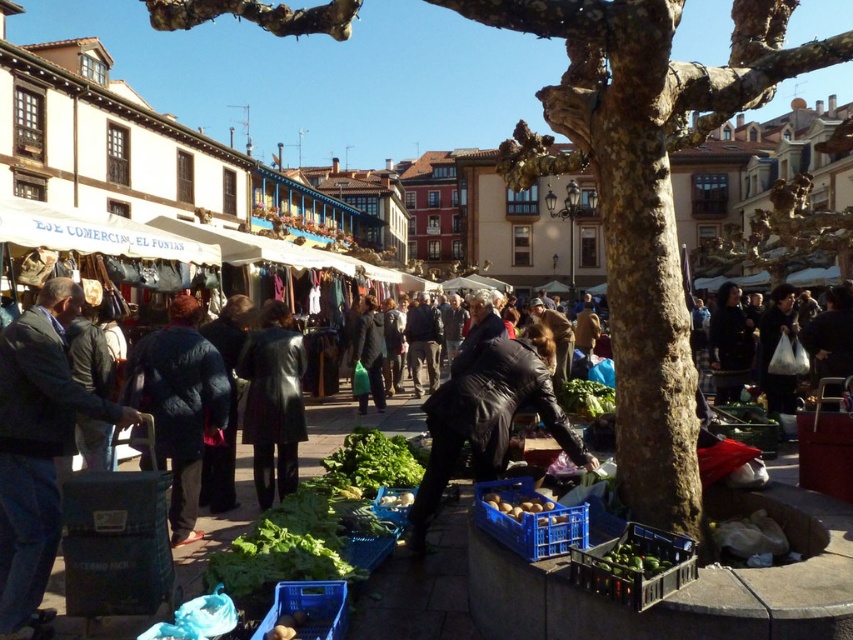
Can you confirm if green matte avocados at lower center is shorter than smooth brown potatoes at lower center?

No, green matte avocados at lower center is not shorter than smooth brown potatoes at lower center.

Who is shorter, green matte avocados at lower center or smooth brown potatoes at lower center?

smooth brown potatoes at lower center is shorter.

Locate an element on the screen. This screenshot has height=640, width=853. green matte avocados at lower center is located at coordinates (633, 561).

Between black leather coat at center and blue plastic crate at lower center, which one is positioned higher?

black leather coat at center

Between black leather coat at center and blue plastic crate at lower center, which one appears on the left side from the viewer's perspective?

Positioned to the left is black leather coat at center.

Is point (294, 384) positioned before point (546, 540)?

No.

Identify the location of black leather coat at center. The image size is (853, 640). (273, 401).

Image resolution: width=853 pixels, height=640 pixels. What are the coordinates of `dark fabric coat at center` in the screenshot? It's located at (730, 342).

Between point (717, 403) and point (631, 552), which one is positioned behind?

Point (717, 403)

Which is behind, point (718, 387) or point (630, 548)?

Positioned behind is point (718, 387).

I want to click on dark fabric coat at center, so click(730, 342).